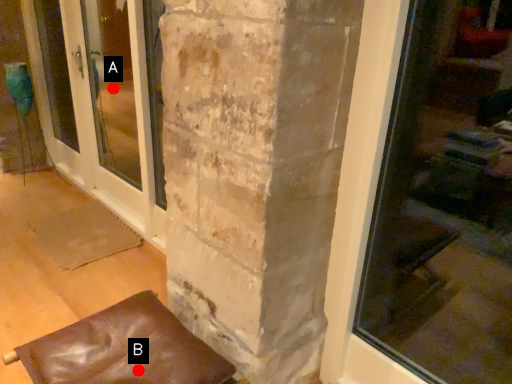
Question: Two points are circled on the image, labeled by A and B beside each circle. Which point is closer to the camera?

Choices:
 (A) A is closer
 (B) B is closer

Answer: (B)